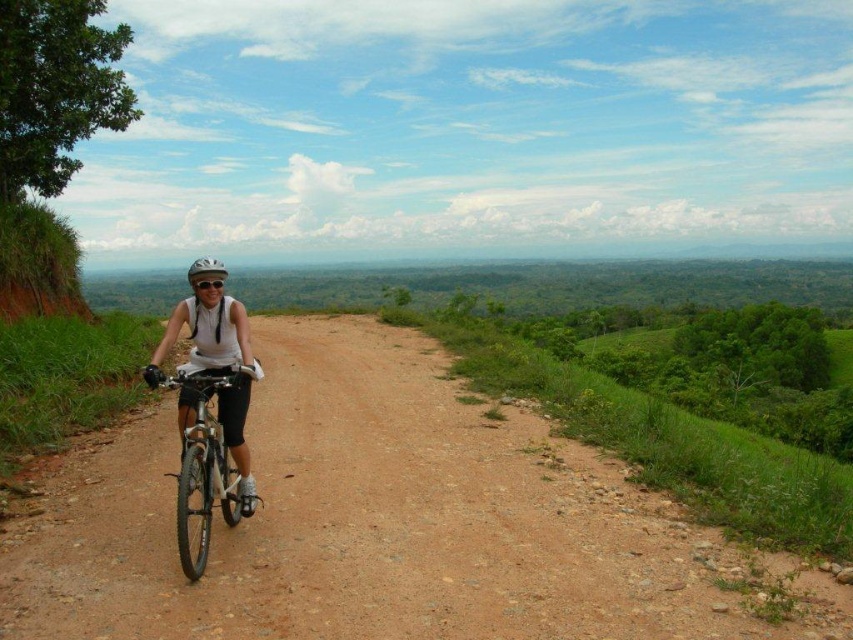
Does brown gravel dirt track at center lie behind white matte helmet at center?

No.

Does point (434, 563) come behind point (248, 515)?

No, (434, 563) is closer to viewer.

Where is `brown gravel dirt track at center`? brown gravel dirt track at center is located at coordinates (384, 524).

The width and height of the screenshot is (853, 640). What do you see at coordinates (384, 524) in the screenshot?
I see `brown gravel dirt track at center` at bounding box center [384, 524].

Measure the distance between point (x=155, y=444) and camera.

They are 8.39 meters apart.

This screenshot has height=640, width=853. In order to click on brown gravel dirt track at center in this screenshot , I will do `click(384, 524)`.

Locate an element on the screen. Image resolution: width=853 pixels, height=640 pixels. silver metallic bicycle at center-left is located at coordinates (202, 460).

Who is taller, silver metallic bicycle at center-left or white matte bicycle helmet at center?

Standing taller between the two is white matte bicycle helmet at center.

You are a GUI agent. You are given a task and a screenshot of the screen. Output one action in this format:
    pyautogui.click(x=<x>, y=<y>)
    Task: Click on the silver metallic bicycle at center-left
    The width and height of the screenshot is (853, 640).
    Given the screenshot: What is the action you would take?
    pyautogui.click(x=202, y=460)